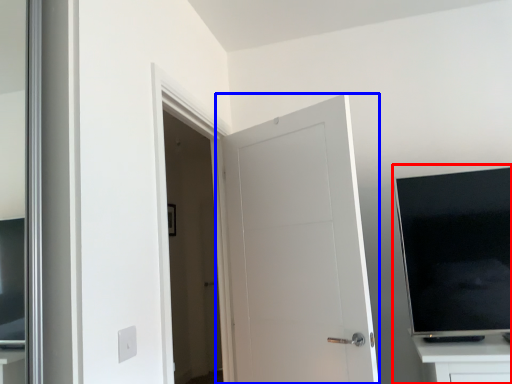
Question: Which point is closer to the camera, entertainment center (highlighted by a red box) or door (highlighted by a blue box)?

Choices:
 (A) entertainment center
 (B) door

Answer: (A)